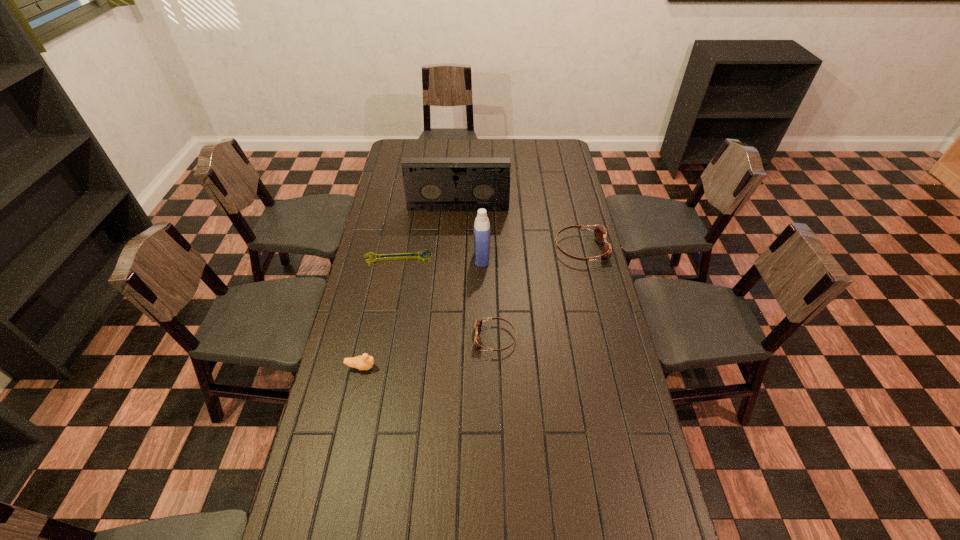
Locate an element on the screen. The width and height of the screenshot is (960, 540). vacant spot to place a goggles on the left is located at coordinates (366, 474).